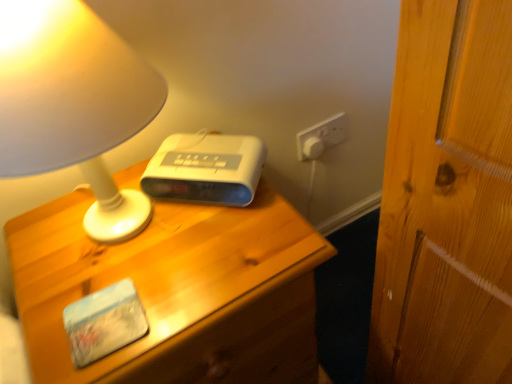
Locate an element on the screen. This screenshot has width=512, height=384. vacant area on top of white plastic alarm clock at center (from a real-world perspective) is located at coordinates [200, 153].